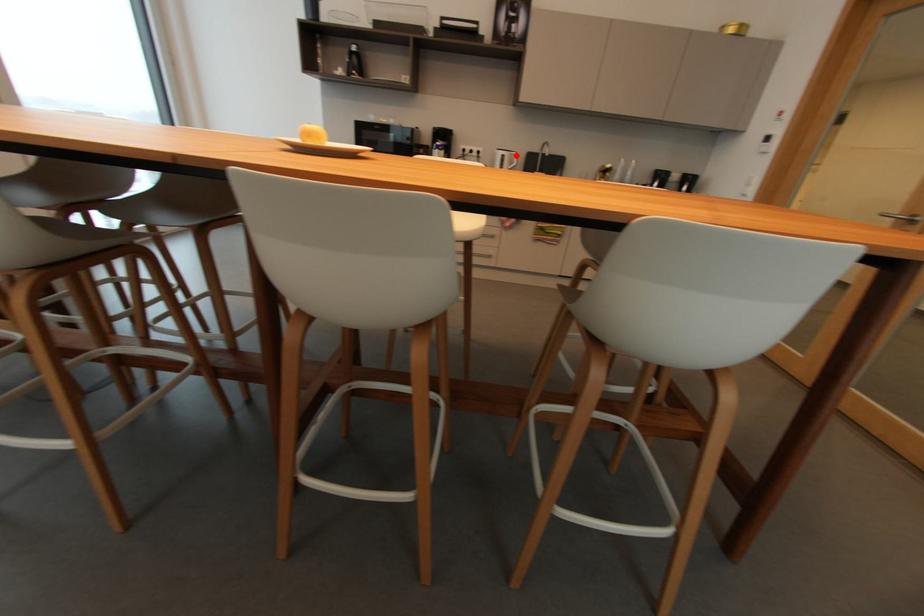
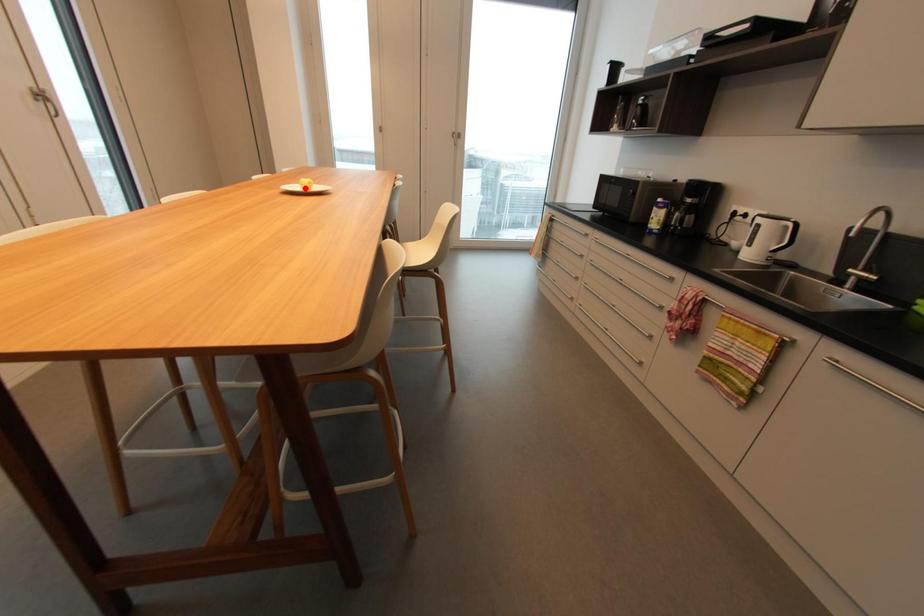
I am providing you with two images of the same scene from different viewpoints. A red point is marked on the first image and another point is marked on the second image. Does the point marked in image1 correspond to the same location as the one in image2?

No